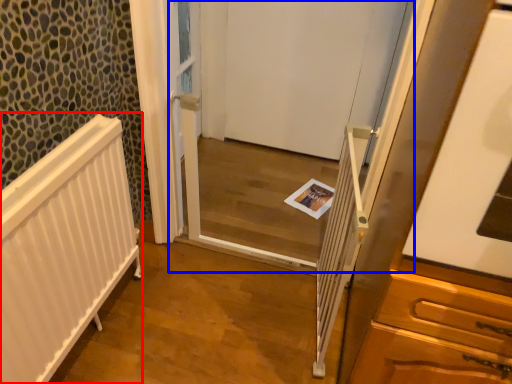
Question: Which object appears closest to the camera in this image, radiator (highlighted by a red box) or screen door (highlighted by a blue box)?

Choices:
 (A) radiator
 (B) screen door

Answer: (A)